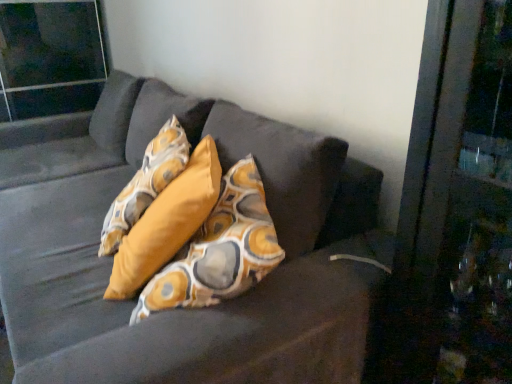
Describe the element at coordinates (181, 310) in the screenshot. The height and width of the screenshot is (384, 512). I see `velvet dark brown couch at center` at that location.

In order to click on velvet dark brown couch at center in this screenshot , I will do `click(181, 310)`.

In order to face velvet dark brown couch at center, should I rotate leftwards or rightwards?

A 14.031 degree turn to the left will do.

Where is `velvet dark brown couch at center`? The height and width of the screenshot is (384, 512). velvet dark brown couch at center is located at coordinates (181, 310).